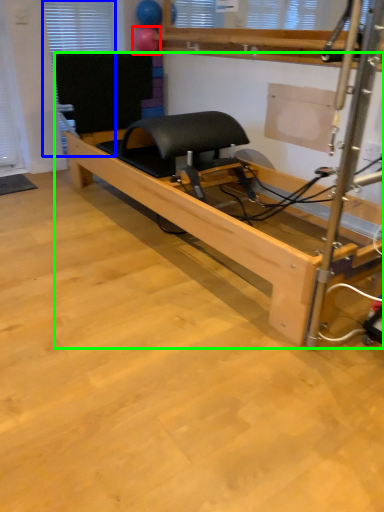
Question: Which object is positioned farthest from balloon (highlighted by a red box)? Select from window (highlighted by a blue box) and furniture (highlighted by a green box).

Choices:
 (A) window
 (B) furniture

Answer: (B)